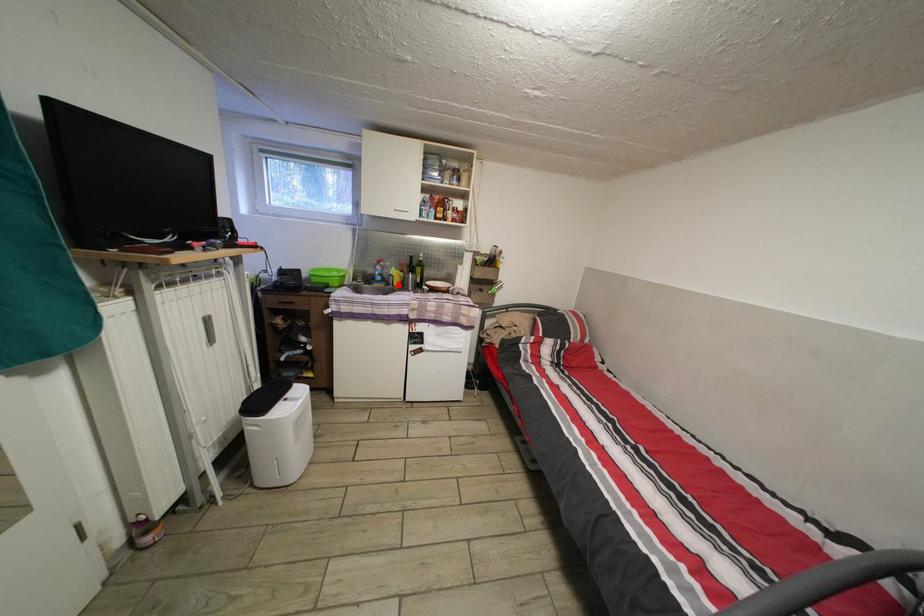
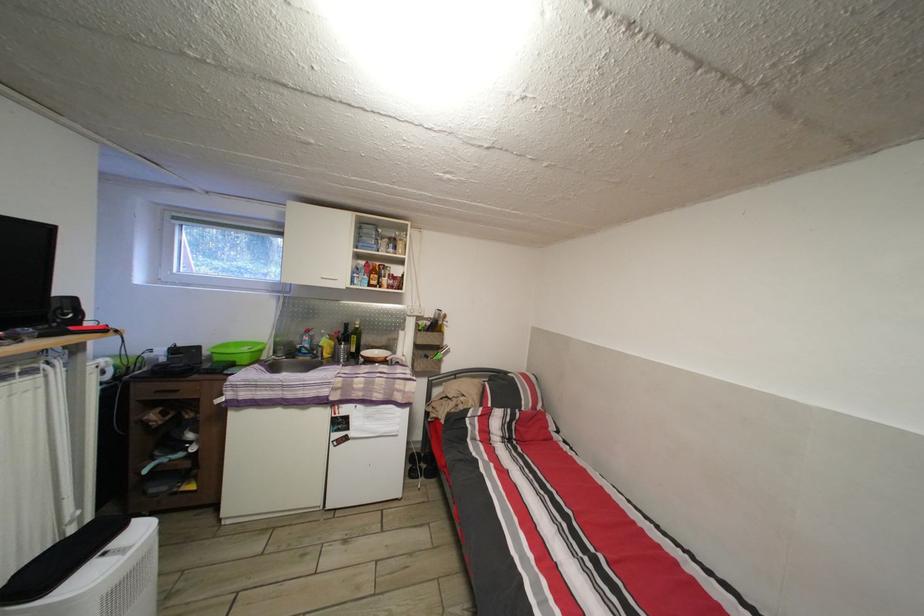
Question: I am providing you with two images of the same scene from different viewpoints. A red point is shown in image1. For the corresponding object point in image2, is it positioned nearer or farther from the camera?

Choices:
 (A) Nearer
 (B) Farther

Answer: (B)